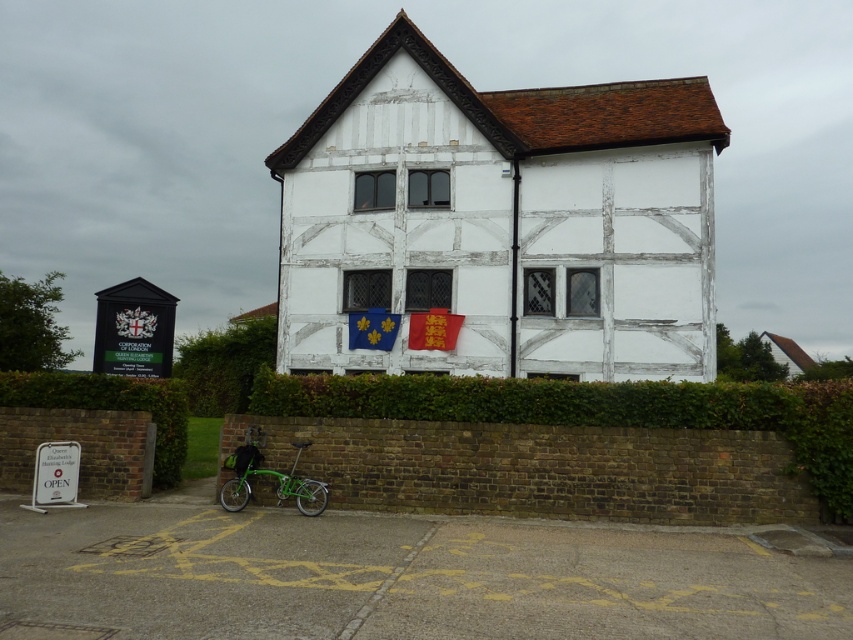
Question: Among these points, which one is nearest to the camera?

Choices:
 (A) (212, 364)
 (B) (251, 451)

Answer: (B)

Question: Which of these objects is positioned closest to the green leafy hedge at center?

Choices:
 (A) green leafy hedge at lower left
 (B) green metallic bicycle at lower left

Answer: (B)

Question: Does green leafy hedge at lower left lie behind green metallic bicycle at lower left?

Choices:
 (A) no
 (B) yes

Answer: (B)

Question: Does green leafy hedge at center have a larger size compared to green metallic bicycle at lower left?

Choices:
 (A) no
 (B) yes

Answer: (B)

Question: Which of the following is the farthest from the observer?

Choices:
 (A) 103,381
 (B) 277,481

Answer: (A)

Question: Does green leafy hedge at lower left appear over green metallic bicycle at lower left?

Choices:
 (A) yes
 (B) no

Answer: (A)